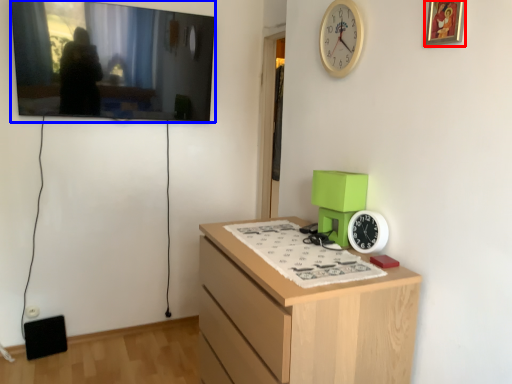
Question: Which point is further to the camera, picture frame (highlighted by a red box) or picture frame (highlighted by a blue box)?

Choices:
 (A) picture frame
 (B) picture frame

Answer: (B)